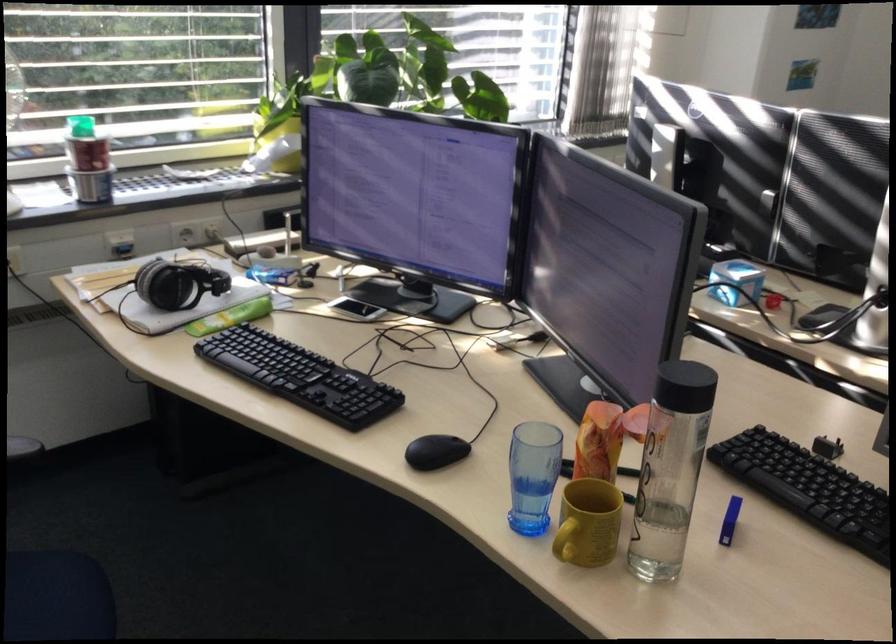
The location [729,520] corresponds to which object?

It refers to a blue pen cap.